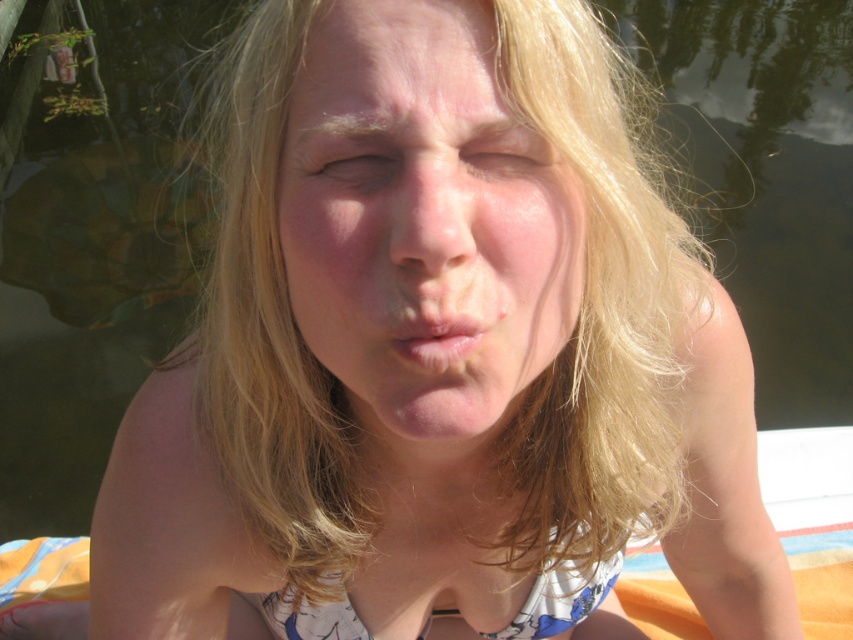
Question: Considering the real-world distances, which object is closest to the pale pink lips at center?

Choices:
 (A) light brown skin at center
 (B) smooth skin nose at center
 (C) smooth skin face at center
 (D) matte skin eye at center

Answer: (B)

Question: Is smooth skin face at center to the left of smooth skin nose at center from the viewer's perspective?

Choices:
 (A) no
 (B) yes

Answer: (A)

Question: Is the position of blonde hair at center less distant than that of light brown skin at center?

Choices:
 (A) yes
 (B) no

Answer: (A)

Question: Based on their relative distances, which object is nearer to the smooth skin nose at center?

Choices:
 (A) blonde hair at center
 (B) smooth skin face at center

Answer: (B)

Question: Which point is farther from the camera taking this photo?

Choices:
 (A) (534, 141)
 (B) (415, 320)

Answer: (A)

Question: Is matte skin eye at center bigger than light brown skin at center?

Choices:
 (A) no
 (B) yes

Answer: (B)